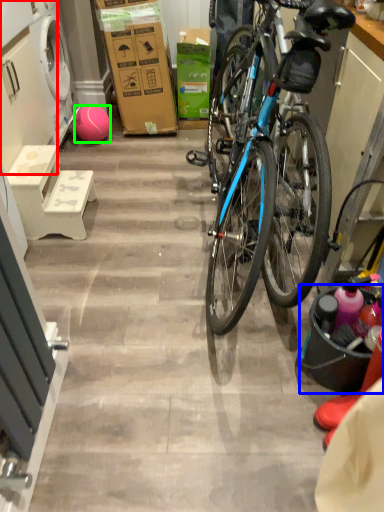
Question: Based on their relative distances, which object is nearer to cabinetry (highlighted by a red box)? Choose from bucket (highlighted by a blue box) and ball (highlighted by a green box).

Choices:
 (A) bucket
 (B) ball

Answer: (B)